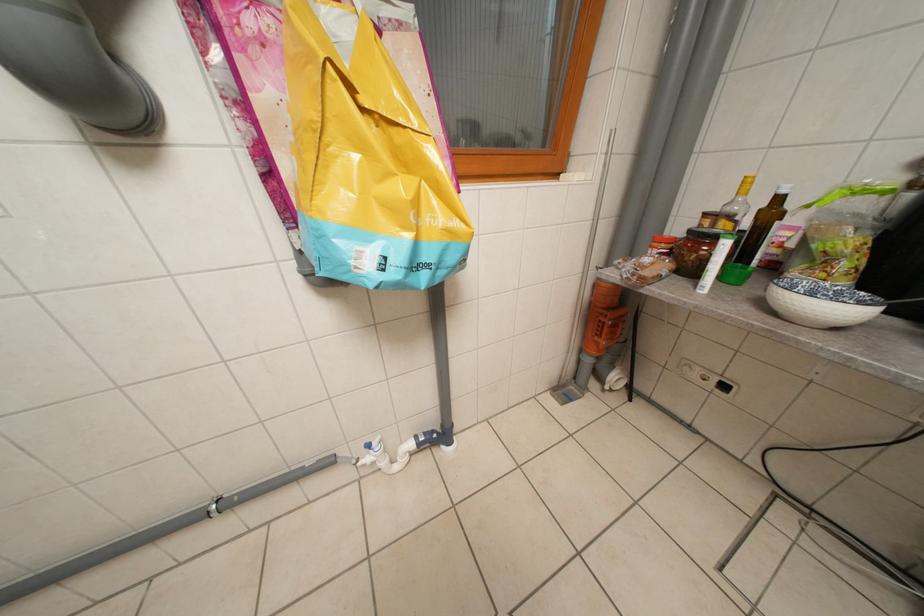
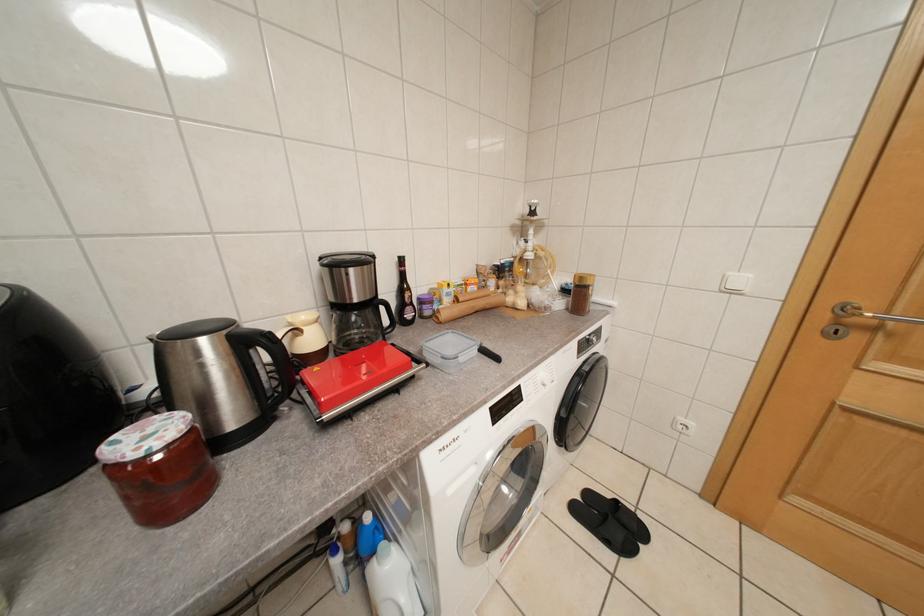
The first image is from the beginning of the video and the second image is from the end. How did the camera likely rotate when shooting the video?

The camera rotated toward right-down.